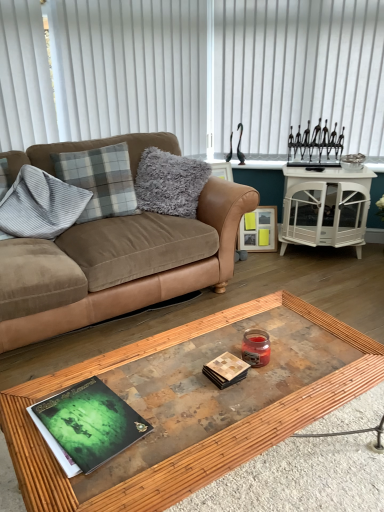
The width and height of the screenshot is (384, 512). What are the coordinates of `free point behind green matte magazine at center, which ranks as the 2th magazine in left-to-right order` in the screenshot? It's located at (213, 339).